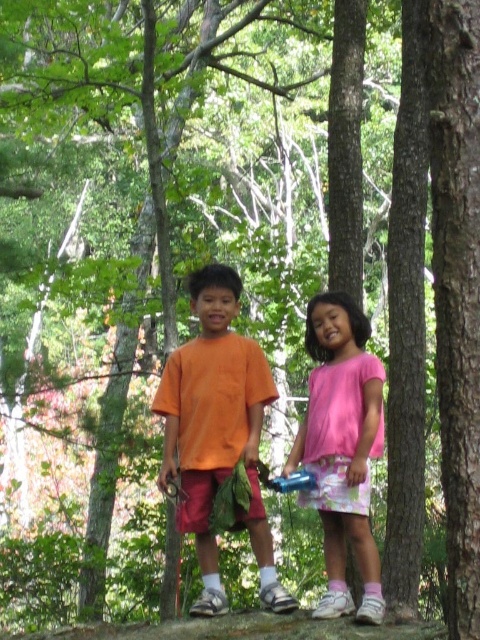
You are a photographer trying to capture a photo of the orange cotton shirt at center and the pink fabric dress at center. Based on their positions, which one should you focus on first to ensure both are in the frame?

The orange cotton shirt at center is located above the pink fabric dress at center, so you should focus on the orange cotton shirt at center first to ensure both are in the frame.

From the picture: You are a photographer setting up a camera to take a group photo of the orange cotton shirt at center and the pink fabric dress at center. The camera has a focus range that can only accommodate objects within a 1.2 meter width. Can both subjects fit within the camera focus range without moving?

The orange cotton shirt at center might be wider than pink fabric dress at center, but since the camera focus range is 1.2 meters, it is uncertain if both will fit without knowing the exact width difference between them.